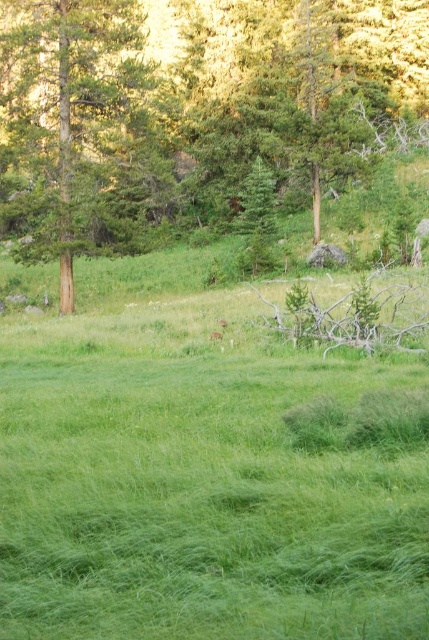
Question: Which object is closer to the camera taking this photo?

Choices:
 (A) green textured tree at left
 (B) brown wood tree at center

Answer: (A)

Question: Is brown wood tree at center below green textured tree at left?

Choices:
 (A) no
 (B) yes

Answer: (A)

Question: Which of the following is the closest to the observer?

Choices:
 (A) (14, 120)
 (B) (51, 147)

Answer: (A)

Question: Does brown wood tree at center have a greater width compared to green textured tree at left?

Choices:
 (A) yes
 (B) no

Answer: (A)

Question: Is brown wood tree at center wider than green textured tree at left?

Choices:
 (A) yes
 (B) no

Answer: (A)

Question: Which of the following is the closest to the observer?

Choices:
 (A) green textured tree at left
 (B) brown wood tree at center

Answer: (A)